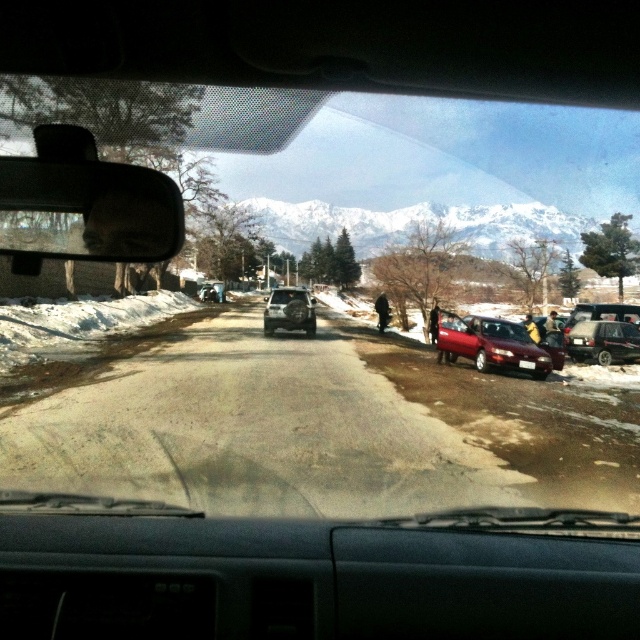
Which of these two, matte red sedan at center or metallic silver sedan at right, stands taller?

matte red sedan at center is taller.

Is point (502, 355) closer to viewer compared to point (589, 355)?

Yes.

At what (x,y) coordinates should I click in order to perform the action: click on matte red sedan at center. Please return your answer as a coordinate pair (x, y). Looking at the image, I should click on (492, 344).

Who is positioned more to the right, matte red sedan at center or satin silver suv at center?

From the viewer's perspective, matte red sedan at center appears more on the right side.

Where is `matte red sedan at center`? This screenshot has width=640, height=640. matte red sedan at center is located at coordinates (492, 344).

Identify the location of matte red sedan at center. (492, 344).

Is matte red sedan at center behind light brown leather jacket at right?

No, it is in front of light brown leather jacket at right.

Is point (484, 349) more distant than point (557, 340)?

That is False.

Which is behind, point (486, 356) or point (554, 340)?

Positioned behind is point (554, 340).

At what (x,y) coordinates should I click in order to perform the action: click on matte red sedan at center. Please return your answer as a coordinate pair (x, y). This screenshot has height=640, width=640. Looking at the image, I should click on [x=492, y=344].